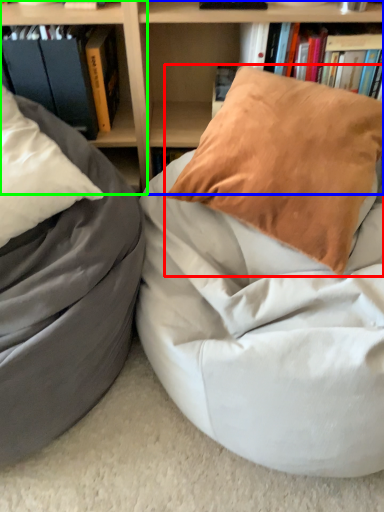
Question: Which object is the farthest from pillow (highlighted by a red box)? Choose among these: bookcase (highlighted by a blue box) or shelf (highlighted by a green box).

Choices:
 (A) bookcase
 (B) shelf

Answer: (B)